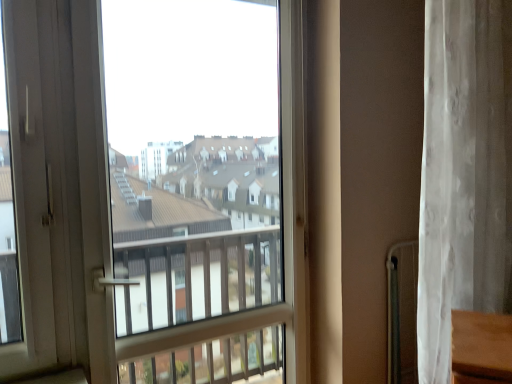
Question: Considering the relative positions of white plastic screen door at left and transparent glass window at center in the image provided, is white plastic screen door at left to the left or to the right of transparent glass window at center?

Choices:
 (A) left
 (B) right

Answer: (A)

Question: From a real-world perspective, is white plastic screen door at left positioned above or below transparent glass window at center?

Choices:
 (A) above
 (B) below

Answer: (A)

Question: Which object is the closest to the transparent glass window at center?

Choices:
 (A) white plastic screen door at left
 (B) white sheer curtain at right

Answer: (A)

Question: Which of these objects is positioned closest to the white plastic screen door at left?

Choices:
 (A) white sheer curtain at right
 (B) transparent glass window at center

Answer: (B)